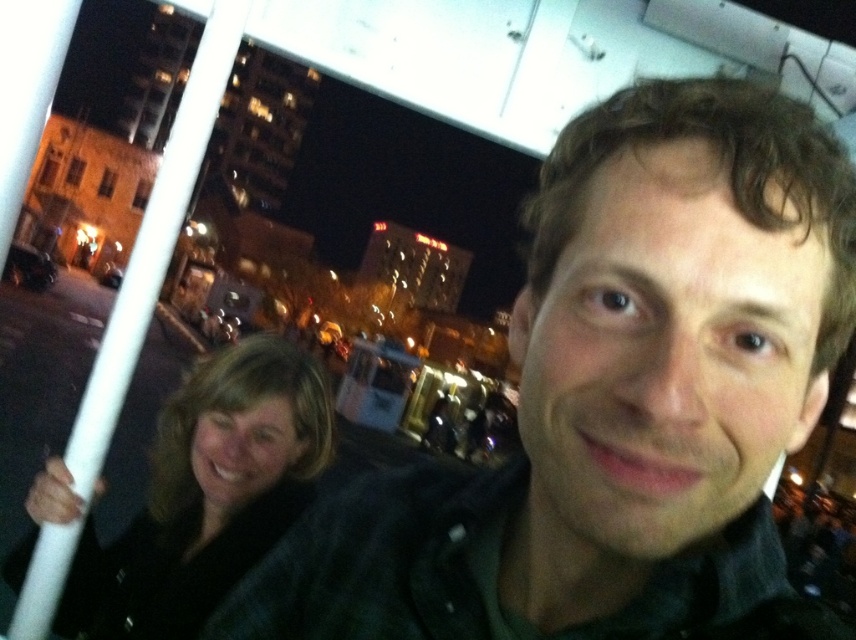
You are a photographer trying to focus on the dark green shirt at center in the nighttime scene. Based on their position, can you estimate if the shirt is closer to the front or back of the image?

The dark green shirt at center is located at point (615, 400), which places it centrally in the image, likely in the midground. However, since the person wearing it is in the foreground with another person partially obscured, it is probably closer to the front of the image.

From the picture: You are a photographer trying to capture a group photo of the dark green shirt at center and dark brown hair at lower left. The camera has a minimum focus distance of 24 inches. Can you take a photo of both subjects without moving them?

The dark green shirt at center and dark brown hair at lower left are 26.18 inches apart from each other. Since the distance between them is greater than the camera minimum focus distance of 24 inches, you can take a photo of both subjects without moving them.

You are a photographer trying to capture a clear shot of the dark green shirt at center and the dark brown hair at lower left. Which object should you focus on first if you want to ensure both are in focus?

The dark green shirt at center should be focused on first since it has a greater height compared to the dark brown hair at lower left, ensuring both can be in focus by adjusting the focus accordingly.